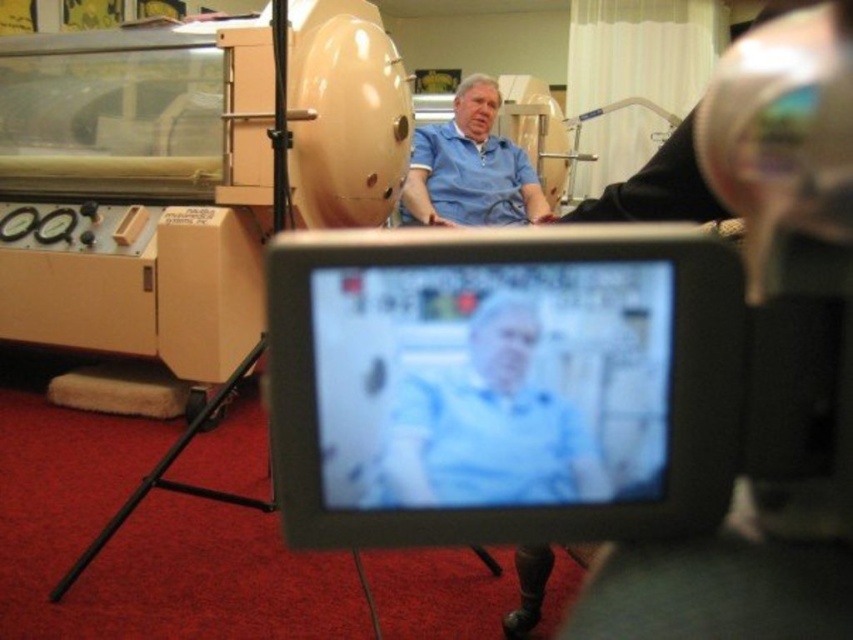
Consider the image. Which of these two, blue fabric at center or blue smooth shirt at center, stands shorter?

blue fabric at center

Which is in front, point (432, 429) or point (480, 205)?

Point (432, 429) is in front.

Find the location of a particular element. This screenshot has width=853, height=640. blue fabric at center is located at coordinates (488, 426).